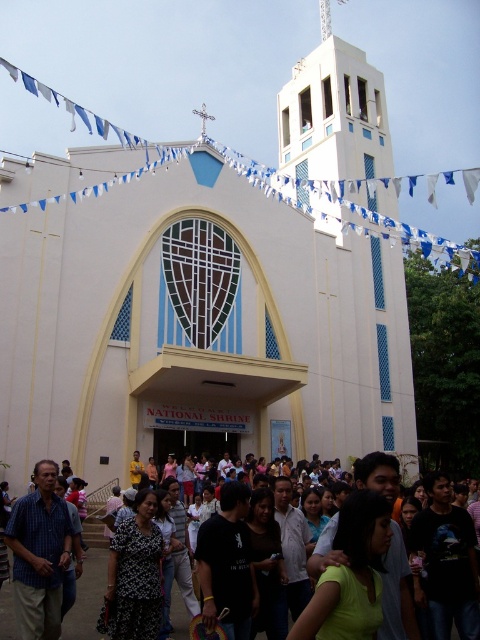
You are a photographer standing in front of the National Shrine. You want to capture both the white smooth church at center and the light green shirt at center in a single photo. Which object should you frame first to ensure both are visible in the photo?

You should frame the white smooth church at center first because it is larger in size than the light green shirt at center, so it requires more space in the composition.